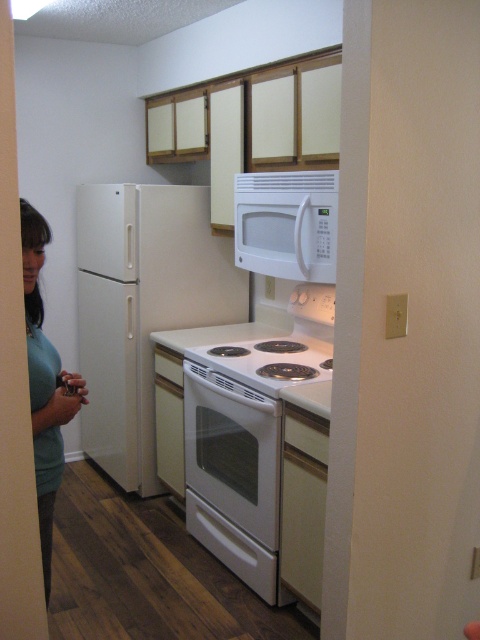
Who is more distant from viewer, (86, 269) or (264, 564)?

Point (86, 269)

Describe the element at coordinates (143, 308) in the screenshot. I see `white glossy refrigerator at left` at that location.

At what (x,y) coordinates should I click in order to perform the action: click on white glossy refrigerator at left. Please return your answer as a coordinate pair (x, y). The height and width of the screenshot is (640, 480). Looking at the image, I should click on (143, 308).

Does white glossy oven at center appear under green matte shirt at lower left?

Yes.

Who is shorter, white glossy oven at center or green matte shirt at lower left?

Standing shorter between the two is white glossy oven at center.

Who is more forward, (193, 490) or (71, 381)?

Positioned in front is point (71, 381).

I want to click on white glossy oven at center, so click(x=232, y=474).

Identify the location of white glossy refrigerator at left. (143, 308).

Who is more distant from viewer, (101, 369) or (303, 272)?

The point (101, 369) is more distant.

Find the location of a particular element. The height and width of the screenshot is (640, 480). white glossy refrigerator at left is located at coordinates (143, 308).